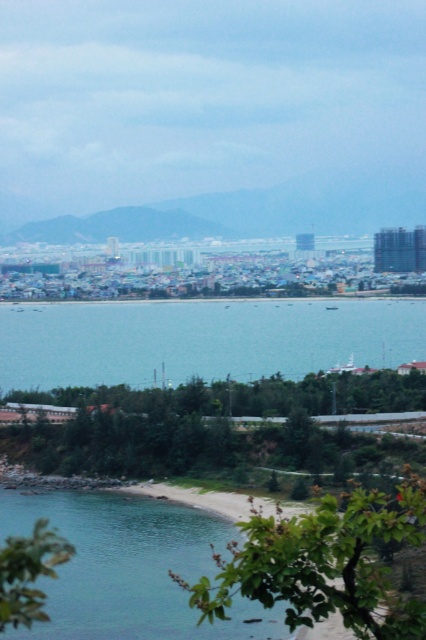
Does clear blue water at center appear over clear water at beach lower left?

Correct, clear blue water at center is located above clear water at beach lower left.

Does point (314, 310) lie in front of point (115, 518)?

No, it is not.

Between point (362, 301) and point (129, 598), which one is positioned behind?

Positioned behind is point (362, 301).

At what (x,y) coordinates should I click in order to perform the action: click on clear blue water at center. Please return your answer as a coordinate pair (x, y). This screenshot has width=426, height=640. Looking at the image, I should click on (201, 339).